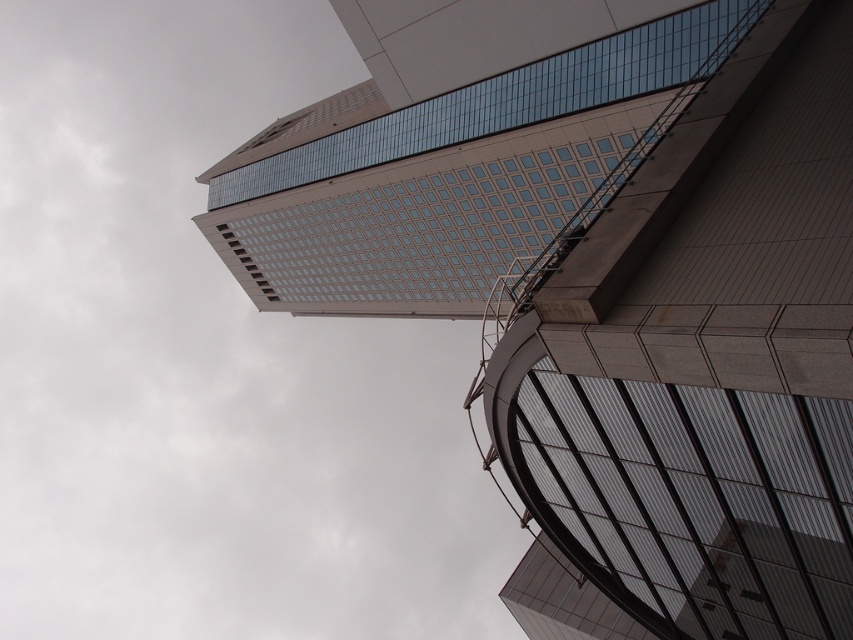
You are standing in front of the tall building and want to take a photo of the smooth glass building at upper center and the glassy reflective tower at upper center. Which one is located below the other?

The smooth glass building at upper center is positioned under the glassy reflective tower at upper center.

You are standing at the base of the tall building in the image. Looking up, you notice a point marked at coordinates (699, 368). What architectural feature is located at that point?

The point at (699, 368) is where the smooth glass building at upper center is located.

You are an architect reviewing a cityscape design. You notice two structures in the image, the smooth glass building at upper center and the glassy reflective tower at upper center. Which of these two structures has a greater height?

The glassy reflective tower at upper center is taller than the smooth glass building at upper center because the smooth glass building at upper center is not as tall as glassy reflective tower at upper center.